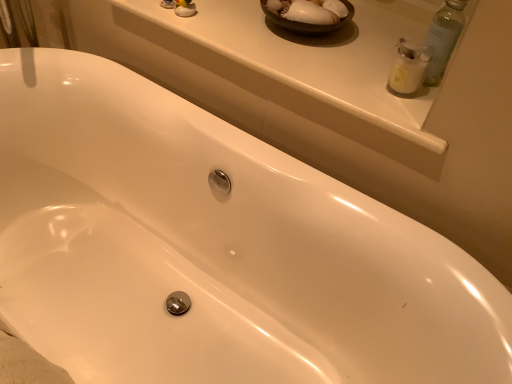
I want to click on free spot behind white matte jar at upper right, so click(366, 55).